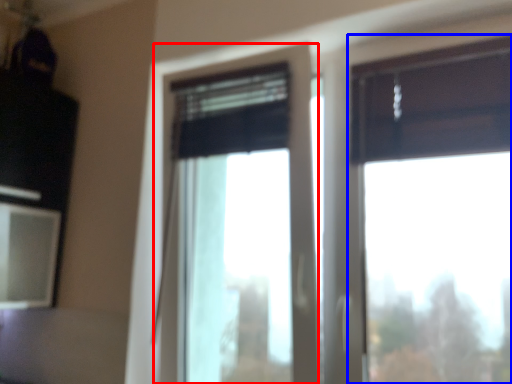
Question: Among these objects, which one is nearest to the camera, window (highlighted by a red box) or window (highlighted by a blue box)?

Choices:
 (A) window
 (B) window

Answer: (B)